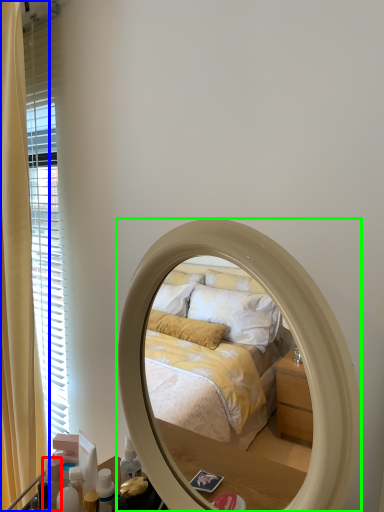
Question: Which object is the closest to the toiletry (highlighted by a red box)? Choose among these: curtain (highlighted by a blue box) or mirror (highlighted by a green box).

Choices:
 (A) curtain
 (B) mirror

Answer: (B)